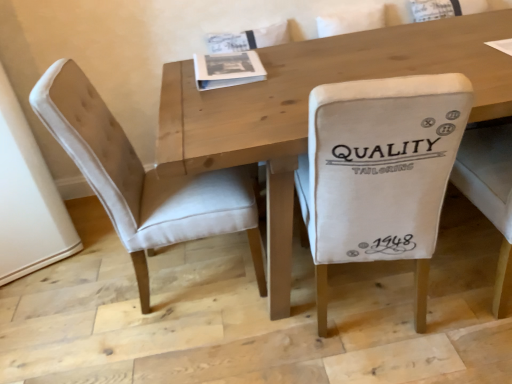
At what (x,y) coordinates should I click in order to perform the action: click on vacant area situated below beige fabric chair at left, the 2th chair in the right-to-left sequence (from a real-world perspective). Please return your answer as a coordinate pair (x, y). The image size is (512, 384). Looking at the image, I should click on (167, 274).